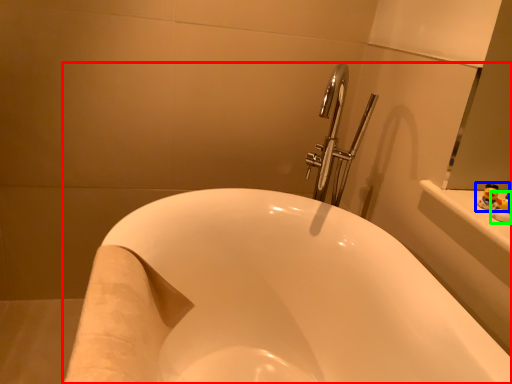
Question: Which is farther away from bathtub (highlighted by a red box)? toy (highlighted by a blue box) or toy (highlighted by a green box)?

Choices:
 (A) toy
 (B) toy

Answer: (B)